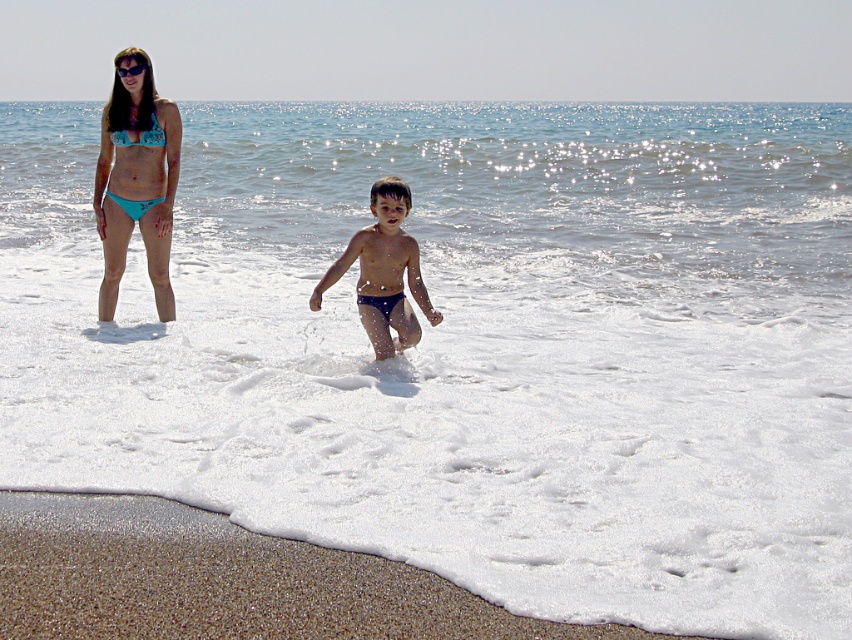
You are standing at the point with coordinates point [401,348] and want to walk to the point with coordinates point [167,296]. Which direction should you move to reach your destination?

To reach point [167,296] from point [401,348], you should move towards the direction where the destination is located behind the starting point. Since point [167,296] is behind point [401,348], you need to walk in the direction opposite to where you are currently facing. However, without knowing the initial facing direction, the most accurate answer based on spatial coordinates is to move towards the northwest direction, as point [167,296] has a lower x and y coordinate compared to point 0.54

You are a photographer taking a picture of the beach scene. You want to ensure both the teal bikini at upper left and the blue textured shorts at center are clearly visible in your shot. Which object should you focus on first to ensure both are in focus?

You should focus on the teal bikini at upper left first because the blue textured shorts at center is behind it, so focusing on the closer object will help both be in focus.